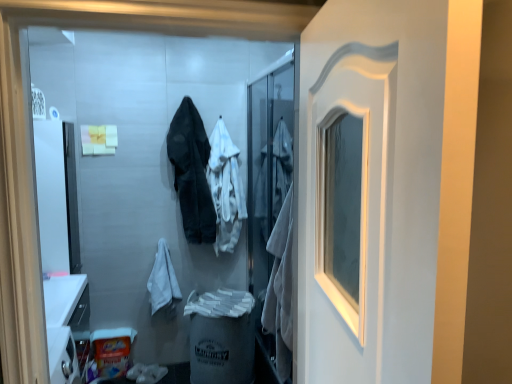
Question: Are dark gray fabric coat at center, positioned as the first clothing in left-to-right order, and white cotton hoodie at center, the first clothing when ordered from right to left, far apart?

Choices:
 (A) yes
 (B) no

Answer: (B)

Question: Is dark gray fabric coat at center, positioned as the first clothing in left-to-right order, behind white cotton hoodie at center, the first clothing when ordered from right to left?

Choices:
 (A) yes
 (B) no

Answer: (B)

Question: Does dark gray fabric coat at center, the second clothing positioned from the right, have a greater height compared to white cotton hoodie at center, the first clothing when ordered from right to left?

Choices:
 (A) no
 (B) yes

Answer: (B)

Question: From a real-world perspective, is dark gray fabric coat at center, the second clothing positioned from the right, on top of white cotton hoodie at center, the 2th clothing from the left?

Choices:
 (A) yes
 (B) no

Answer: (A)

Question: Could you tell me if dark gray fabric coat at center, positioned as the first clothing in left-to-right order, is turned towards white cotton hoodie at center, the first clothing when ordered from right to left?

Choices:
 (A) no
 (B) yes

Answer: (A)

Question: Relative to white cotton bathrobe at lower left, is white cotton hoodie at center, the 2th clothing from the left, in front or behind?

Choices:
 (A) behind
 (B) front

Answer: (A)

Question: Is point (220, 180) positioned closer to the camera than point (158, 241)?

Choices:
 (A) farther
 (B) closer

Answer: (B)

Question: Considering the relative positions of white cotton hoodie at center, the 2th clothing from the left, and white cotton bathrobe at lower left in the image provided, is white cotton hoodie at center, the 2th clothing from the left, to the left or to the right of white cotton bathrobe at lower left?

Choices:
 (A) left
 (B) right

Answer: (B)

Question: From a real-world perspective, is white cotton hoodie at center, the 2th clothing from the left, above or below white cotton bathrobe at lower left?

Choices:
 (A) below
 (B) above

Answer: (B)

Question: Considering the positions of point (155, 283) and point (175, 180), is point (155, 283) closer or farther from the camera than point (175, 180)?

Choices:
 (A) closer
 (B) farther

Answer: (A)

Question: In terms of size, does white cotton bathrobe at lower left appear bigger or smaller than dark gray fabric coat at center, the second clothing positioned from the right?

Choices:
 (A) big
 (B) small

Answer: (B)

Question: In terms of width, does white cotton bathrobe at lower left look wider or thinner when compared to dark gray fabric coat at center, the second clothing positioned from the right?

Choices:
 (A) thin
 (B) wide

Answer: (A)

Question: Is white cotton bathrobe at lower left in front of or behind dark gray fabric coat at center, the second clothing positioned from the right, in the image?

Choices:
 (A) front
 (B) behind

Answer: (B)

Question: In terms of size, does white matte screen door at center appear bigger or smaller than white cotton hoodie at center, the 2th clothing from the left?

Choices:
 (A) big
 (B) small

Answer: (A)

Question: In terms of height, does white matte screen door at center look taller or shorter compared to white cotton hoodie at center, the 2th clothing from the left?

Choices:
 (A) short
 (B) tall

Answer: (B)